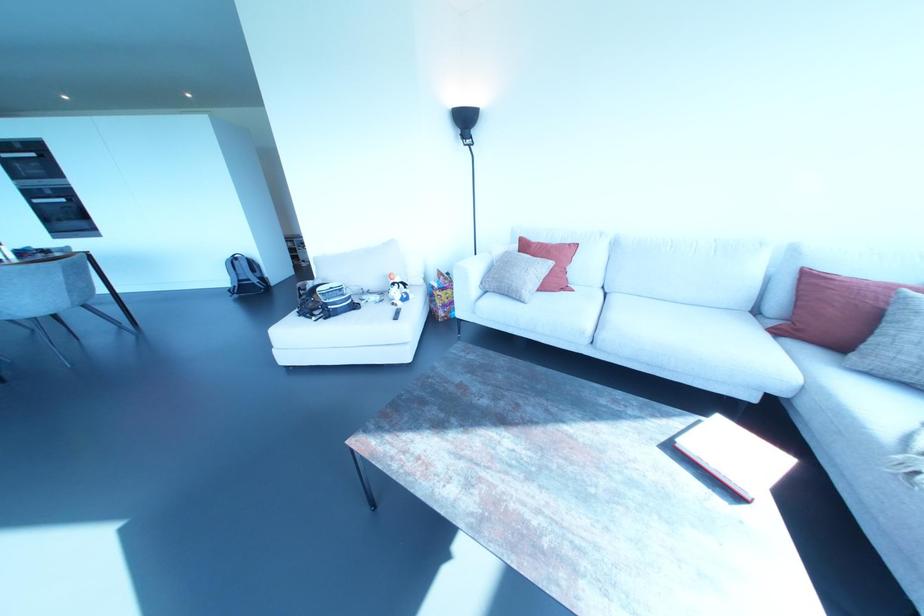
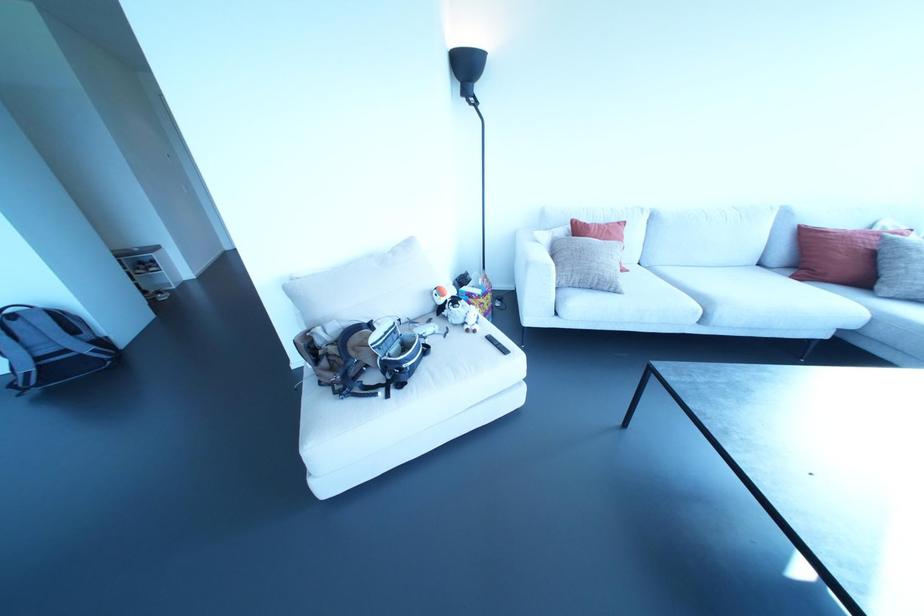
In the second image, find the point that corresponds to point (392, 302) in the first image.

(467, 330)